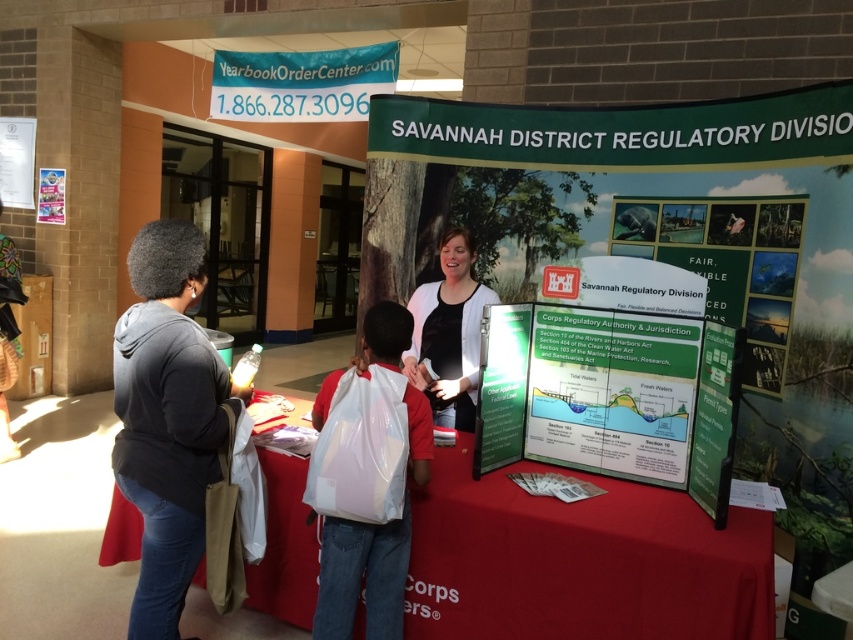
Question: Does white plastic bag at center have a smaller size compared to white paper at upper left?

Choices:
 (A) no
 (B) yes

Answer: (A)

Question: Estimate the real-world distances between objects in this image. Which object is farther from the green matte poster at center?

Choices:
 (A) white paper at upper left
 (B) dark gray hoodie at left
 (C) blue fabric banner at upper center
 (D) white paper poster at center

Answer: (A)

Question: Among these points, which one is nearest to the camera?

Choices:
 (A) (395, 536)
 (B) (51, 196)
 (C) (26, 128)

Answer: (A)

Question: Is blue fabric banner at upper center smaller than green paper at center?

Choices:
 (A) no
 (B) yes

Answer: (A)

Question: Which is nearer to the green matte poster at center?

Choices:
 (A) white plastic bag at center
 (B) white paper at upper left
 (C) blue fabric banner at upper center

Answer: (A)

Question: Does green matte poster at center have a greater width compared to white paper at upper left?

Choices:
 (A) no
 (B) yes

Answer: (B)